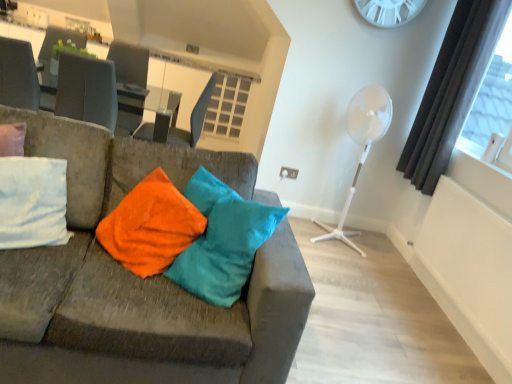
Question: Is glassy white table at upper center turned away from white plastic clock at upper center?

Choices:
 (A) yes
 (B) no

Answer: (B)

Question: Does glassy white table at upper center lie in front of white plastic clock at upper center?

Choices:
 (A) yes
 (B) no

Answer: (B)

Question: Is glassy white table at upper center further to camera compared to white plastic clock at upper center?

Choices:
 (A) yes
 (B) no

Answer: (A)

Question: From the image's perspective, is glassy white table at upper center beneath white plastic clock at upper center?

Choices:
 (A) no
 (B) yes

Answer: (B)

Question: Is glassy white table at upper center surrounding white plastic clock at upper center?

Choices:
 (A) no
 (B) yes

Answer: (A)

Question: Can you confirm if glassy white table at upper center is shorter than white plastic clock at upper center?

Choices:
 (A) yes
 (B) no

Answer: (B)

Question: Can you confirm if white plastic fan at right is shorter than dark gray curtain at right?

Choices:
 (A) no
 (B) yes

Answer: (B)

Question: From the image's perspective, is white plastic fan at right beneath dark gray curtain at right?

Choices:
 (A) no
 (B) yes

Answer: (B)

Question: Can you confirm if white plastic fan at right is bigger than dark gray curtain at right?

Choices:
 (A) yes
 (B) no

Answer: (A)

Question: Is white plastic fan at right oriented away from dark gray curtain at right?

Choices:
 (A) no
 (B) yes

Answer: (B)

Question: From the image's perspective, would you say white plastic fan at right is positioned over dark gray curtain at right?

Choices:
 (A) yes
 (B) no

Answer: (B)

Question: Can you confirm if white plastic fan at right is thinner than dark gray curtain at right?

Choices:
 (A) no
 (B) yes

Answer: (A)

Question: From the image's perspective, is velvet fabric couch at left above dark gray curtain at right?

Choices:
 (A) yes
 (B) no

Answer: (B)